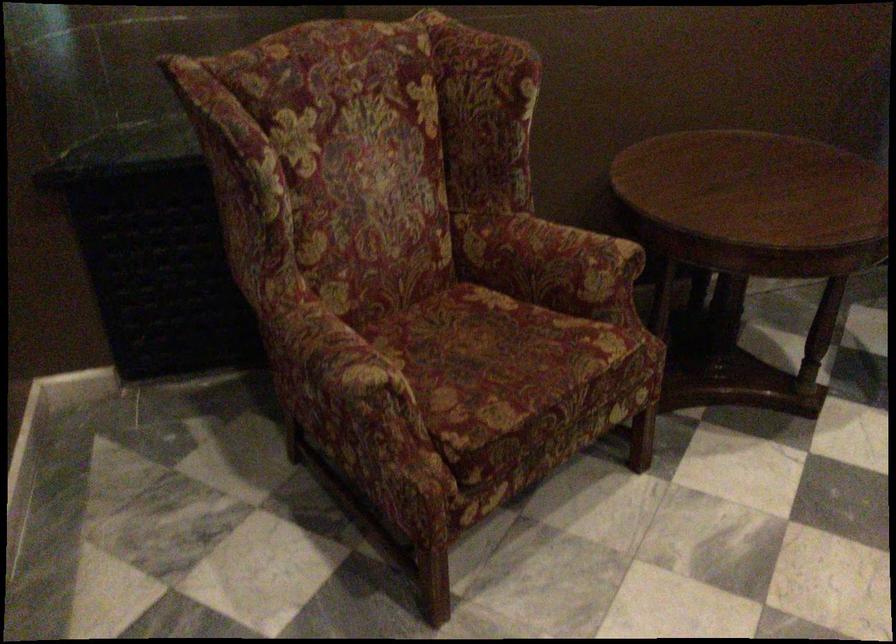
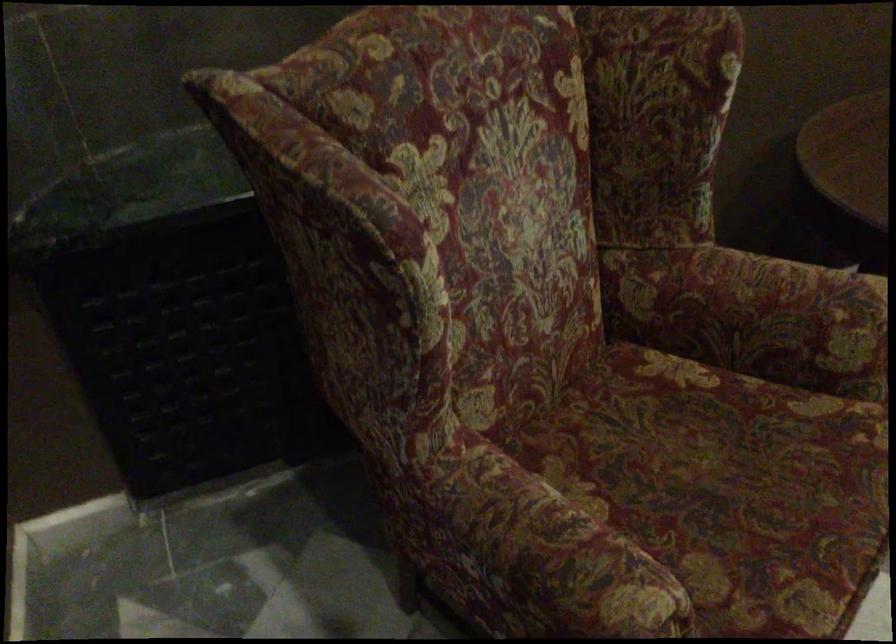
Find the pixel in the second image that matches (x=486, y=355) in the first image.

(726, 486)